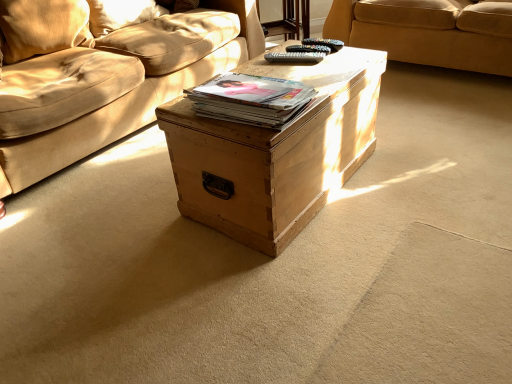
This screenshot has height=384, width=512. Describe the element at coordinates (429, 31) in the screenshot. I see `beige fabric couch at upper center` at that location.

Where is `black plastic remote at center`? The width and height of the screenshot is (512, 384). black plastic remote at center is located at coordinates (295, 57).

Measure the distance between black plastic remote at center and camera.

They are 1.58 meters apart.

What do you see at coordinates (42, 26) in the screenshot? I see `velvet beige pillow at upper left, which is the first pillow in front-to-back order` at bounding box center [42, 26].

Find the location of a particular element. Image resolution: width=512 pixels, height=384 pixels. beige fabric couch at upper center is located at coordinates (429, 31).

Does point (483, 38) lie in front of point (133, 15)?

Yes, point (483, 38) is closer to viewer.

Looking at this image, would you say beige fabric couch at upper center is a long distance from soft beige pillow at upper left, the second pillow viewed from the front?

Yes.

Is beige fabric couch at upper center completely or partially outside of soft beige pillow at upper left, the second pillow viewed from the front?

Yes, beige fabric couch at upper center is not within soft beige pillow at upper left, the second pillow viewed from the front.

Who is more distant, natural wood trunk at center or velvet beige pillow at upper left, the second pillow in the back-to-front sequence?

velvet beige pillow at upper left, the second pillow in the back-to-front sequence, is further away from the camera.

Is point (263, 178) closer to viewer compared to point (76, 5)?

Yes.

Considering the positions of objects natural wood trunk at center and velvet beige pillow at upper left, which is the first pillow in front-to-back order, in the image provided, who is more to the right, natural wood trunk at center or velvet beige pillow at upper left, which is the first pillow in front-to-back order,?

natural wood trunk at center is more to the right.

Is velvet beige pillow at upper left, the second pillow in the back-to-front sequence, directly adjacent to black plastic remote at center?

They are not placed beside each other.

Is velvet beige pillow at upper left, the second pillow in the back-to-front sequence, shorter than black plastic remote at center?

No, velvet beige pillow at upper left, the second pillow in the back-to-front sequence, is not shorter than black plastic remote at center.

Which of these two, velvet beige pillow at upper left, which is the first pillow in front-to-back order, or black plastic remote at center, is bigger?

velvet beige pillow at upper left, which is the first pillow in front-to-back order.

Do you think velvet beige pillow at upper left, the second pillow in the back-to-front sequence, is within black plastic remote at center, or outside of it?

velvet beige pillow at upper left, the second pillow in the back-to-front sequence, is not inside black plastic remote at center, it's outside.

In the scene shown: Is matte brown book at center surrounding natural wood trunk at center?

No, natural wood trunk at center is not a part of matte brown book at center.

Can you confirm if matte brown book at center is wider than natural wood trunk at center?

In fact, matte brown book at center might be narrower than natural wood trunk at center.

Is matte brown book at center to the left or to the right of natural wood trunk at center in the image?

Based on their positions, matte brown book at center is located to the left of natural wood trunk at center.

Is matte brown book at center shorter than natural wood trunk at center?

Yes, matte brown book at center is shorter than natural wood trunk at center.

Who is shorter, matte brown book at center or soft beige pillow at upper left, the second pillow viewed from the front?

matte brown book at center is shorter.

Looking at their sizes, would you say matte brown book at center is wider or thinner than soft beige pillow at upper left, which is counted as the 1th pillow, starting from the back?

matte brown book at center is wider than soft beige pillow at upper left, which is counted as the 1th pillow, starting from the back.

From the image's perspective, which is above, matte brown book at center or soft beige pillow at upper left, which is counted as the 1th pillow, starting from the back?

soft beige pillow at upper left, which is counted as the 1th pillow, starting from the back, appears higher in the image.

Is point (95, 34) in front of point (244, 75)?

That is False.

From the image's perspective, who appears lower, soft beige pillow at upper left, which is counted as the 1th pillow, starting from the back, or matte brown book at center?

matte brown book at center is shown below in the image.

How many degrees apart are the facing directions of soft beige pillow at upper left, which is counted as the 1th pillow, starting from the back, and matte brown book at center?

The angular difference between soft beige pillow at upper left, which is counted as the 1th pillow, starting from the back, and matte brown book at center is 4.37 degrees.

Does soft beige pillow at upper left, the second pillow viewed from the front, turn towards matte brown book at center?

Yes, soft beige pillow at upper left, the second pillow viewed from the front, is aimed at matte brown book at center.

Is matte brown book at center facing towards beige fabric couch at upper center?

Result: No, matte brown book at center is not oriented towards beige fabric couch at upper center.

Is point (277, 106) positioned before point (429, 8)?

Yes.

Is beige fabric couch at upper center surrounded by matte brown book at center?

Actually, beige fabric couch at upper center is outside matte brown book at center.

Is matte brown book at center to the right of beige fabric couch at upper center from the viewer's perspective?

No.

Locate an element on the screen. studio couch that is in front of the soft beige pillow at upper left, which is counted as the 1th pillow, starting from the back is located at coordinates (429, 31).

The height and width of the screenshot is (384, 512). What are the coordinates of `the 1st pillow above the natural wood trunk at center (from the image's perspective)` in the screenshot? It's located at (42, 26).

Considering their positions, is matte brown book at center positioned further to natural wood trunk at center than black plastic remote at center?

Based on the image, black plastic remote at center appears to be further to natural wood trunk at center.

Considering their positions, is natural wood trunk at center positioned further to black plastic remote at center than soft beige pillow at upper left, the second pillow viewed from the front?

Based on the image, soft beige pillow at upper left, the second pillow viewed from the front, appears to be further to black plastic remote at center.

From the image, which object appears to be farther from soft beige pillow at upper left, the second pillow viewed from the front, beige fabric couch at upper center or velvet beige pillow at upper left, which is the first pillow in front-to-back order?

beige fabric couch at upper center is further to soft beige pillow at upper left, the second pillow viewed from the front.

Which object lies further to the anchor point soft beige pillow at upper left, which is counted as the 1th pillow, starting from the back, beige fabric couch at upper center or black plastic remote at center?

The object further to soft beige pillow at upper left, which is counted as the 1th pillow, starting from the back, is beige fabric couch at upper center.

Which object lies further to the anchor point matte brown book at center, soft beige pillow at upper left, which is counted as the 1th pillow, starting from the back, or beige fabric couch at upper center?

beige fabric couch at upper center is further to matte brown book at center.

Looking at the image, which one is located further to velvet beige pillow at upper left, the second pillow in the back-to-front sequence, matte brown book at center or black plastic remote at center?

Among the two, matte brown book at center is located further to velvet beige pillow at upper left, the second pillow in the back-to-front sequence.

Which object lies further to the anchor point beige fabric couch at upper center, matte brown book at center or velvet beige pillow at upper left, the second pillow in the back-to-front sequence?

Among the two, velvet beige pillow at upper left, the second pillow in the back-to-front sequence, is located further to beige fabric couch at upper center.

Based on their spatial positions, is beige fabric couch at upper center or soft beige pillow at upper left, the second pillow viewed from the front, closer to matte brown book at center?

soft beige pillow at upper left, the second pillow viewed from the front, lies closer to matte brown book at center than the other object.

Identify the location of pillow between velvet beige pillow at upper left, the second pillow in the back-to-front sequence, and beige fabric couch at upper center from left to right. The height and width of the screenshot is (384, 512). (121, 14).

Image resolution: width=512 pixels, height=384 pixels. I want to click on paperback book located between soft beige pillow at upper left, the second pillow viewed from the front, and beige fabric couch at upper center in the left-right direction, so click(x=250, y=99).

Locate an element on the screen. The height and width of the screenshot is (384, 512). remote between matte brown book at center and beige fabric couch at upper center in the horizontal direction is located at coordinates (295, 57).

The height and width of the screenshot is (384, 512). I want to click on pillow between velvet beige pillow at upper left, the second pillow in the back-to-front sequence, and black plastic remote at center, so click(x=121, y=14).